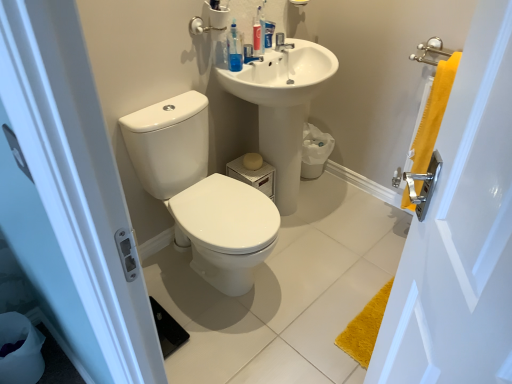
Question: Is satin nickel faucet at upper center not inside white glossy toilet at center?

Choices:
 (A) no
 (B) yes

Answer: (B)

Question: Considering the relative positions of satin nickel faucet at upper center and white glossy toilet at center in the image provided, is satin nickel faucet at upper center in front of white glossy toilet at center?

Choices:
 (A) yes
 (B) no

Answer: (B)

Question: Considering the relative sizes of satin nickel faucet at upper center and white glossy toilet at center in the image provided, is satin nickel faucet at upper center thinner than white glossy toilet at center?

Choices:
 (A) yes
 (B) no

Answer: (A)

Question: Considering the relative sizes of satin nickel faucet at upper center and white glossy toilet at center in the image provided, is satin nickel faucet at upper center smaller than white glossy toilet at center?

Choices:
 (A) no
 (B) yes

Answer: (B)

Question: Does satin nickel faucet at upper center come behind white glossy toilet at center?

Choices:
 (A) yes
 (B) no

Answer: (A)

Question: Is satin nickel faucet at upper center bigger than white glossy toilet at center?

Choices:
 (A) no
 (B) yes

Answer: (A)

Question: Is the depth of translucent plastic toothpaste tube at upper center less than that of satin nickel faucet at upper center?

Choices:
 (A) no
 (B) yes

Answer: (B)

Question: From a real-world perspective, is translucent plastic toothpaste tube at upper center physically above satin nickel faucet at upper center?

Choices:
 (A) no
 (B) yes

Answer: (B)

Question: From a real-world perspective, is translucent plastic toothpaste tube at upper center positioned under satin nickel faucet at upper center based on gravity?

Choices:
 (A) yes
 (B) no

Answer: (B)

Question: Is translucent plastic toothpaste tube at upper center taller than satin nickel faucet at upper center?

Choices:
 (A) no
 (B) yes

Answer: (B)

Question: From the image's perspective, does translucent plastic toothpaste tube at upper center appear higher than satin nickel faucet at upper center?

Choices:
 (A) yes
 (B) no

Answer: (B)

Question: Is satin nickel faucet at upper center located within translucent plastic toothpaste tube at upper center?

Choices:
 (A) no
 (B) yes

Answer: (A)

Question: Can you confirm if white glossy toilet at center is shorter than yellow fabric towel at right?

Choices:
 (A) yes
 (B) no

Answer: (A)